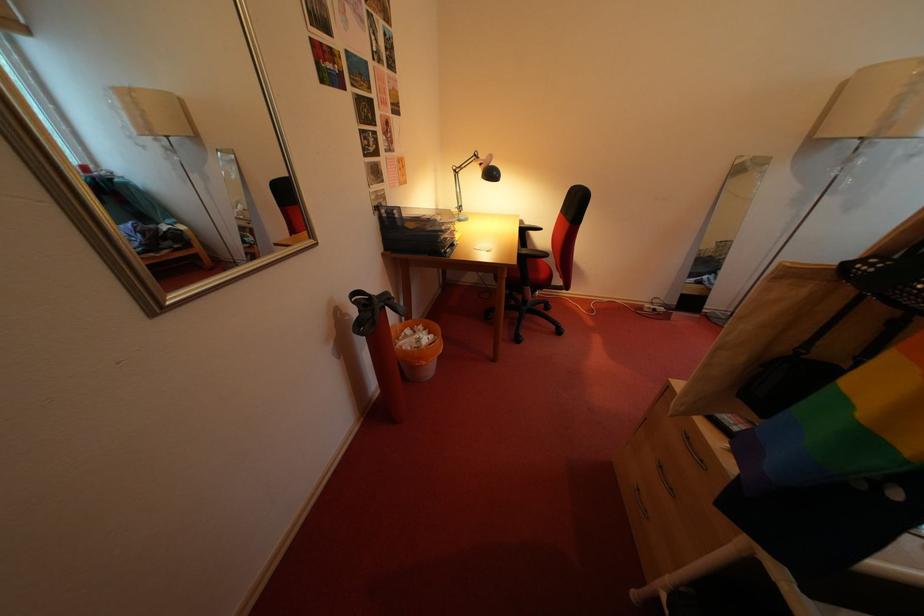
Where would you lift the black strap? Please return your answer as a coordinate pair (x, y).

(371, 310)